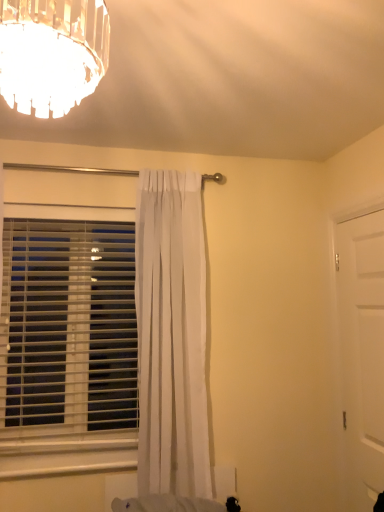
Question: From a real-world perspective, is white matte door at right above or below white sheer curtain at center?

Choices:
 (A) above
 (B) below

Answer: (B)

Question: Is point (347, 440) closer or farther from the camera than point (158, 365)?

Choices:
 (A) farther
 (B) closer

Answer: (A)

Question: Considering the real-world distances, which object is farthest from the white plastic blinds at left?

Choices:
 (A) white matte door at right
 (B) white sheer curtain at center

Answer: (A)

Question: Which object is the farthest from the white sheer curtain at center?

Choices:
 (A) white plastic blinds at left
 (B) white matte door at right

Answer: (B)